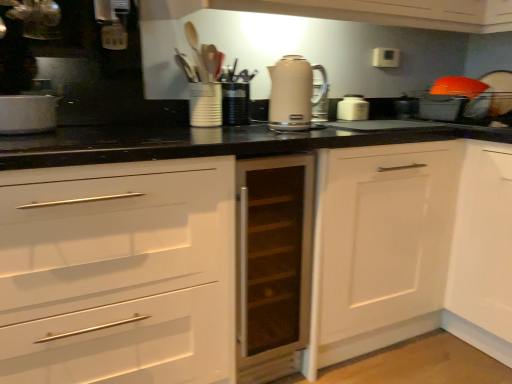
Question: Can you confirm if matte white container at center, which is counted as the 2th appliance, starting from the right, is bigger than transparent glass cabinet at center, which appears as the second cabinetry when viewed from the right?

Choices:
 (A) no
 (B) yes

Answer: (A)

Question: Can transparent glass cabinet at center, the 1th cabinetry positioned from the left, be found inside matte white container at center, which is counted as the 2th appliance, starting from the right?

Choices:
 (A) yes
 (B) no

Answer: (B)

Question: Is matte white container at center, acting as the 1th appliance starting from the left, smaller than transparent glass cabinet at center, the 1th cabinetry positioned from the left?

Choices:
 (A) yes
 (B) no

Answer: (A)

Question: Could you tell me if matte white container at center, which is counted as the 2th appliance, starting from the right, is facing transparent glass cabinet at center, which appears as the second cabinetry when viewed from the right?

Choices:
 (A) yes
 (B) no

Answer: (B)

Question: Is matte white container at center, which is counted as the 2th appliance, starting from the right, taller or shorter than black plastic container at center, which ranks as the second appliance in left-to-right order?

Choices:
 (A) short
 (B) tall

Answer: (B)

Question: Which is correct: matte white container at center, which is counted as the 2th appliance, starting from the right, is inside black plastic container at center, which ranks as the second appliance in left-to-right order, or outside of it?

Choices:
 (A) inside
 (B) outside

Answer: (B)

Question: From the image's perspective, is matte white container at center, which is counted as the 2th appliance, starting from the right, located above or below black plastic container at center, the first appliance when ordered from right to left?

Choices:
 (A) below
 (B) above

Answer: (A)

Question: Relative to black plastic container at center, the first appliance when ordered from right to left, is matte white container at center, which is counted as the 2th appliance, starting from the right, in front or behind?

Choices:
 (A) front
 (B) behind

Answer: (A)

Question: In terms of height, does black plastic container at center, which ranks as the second appliance in left-to-right order, look taller or shorter compared to white glossy toaster at center, which is counted as the third kitchen appliance, starting from the front?

Choices:
 (A) tall
 (B) short

Answer: (A)

Question: Considering their positions, is black plastic container at center, the first appliance when ordered from right to left, located in front of or behind white glossy toaster at center, which is the 3th kitchen appliance from left to right?

Choices:
 (A) front
 (B) behind

Answer: (A)

Question: Considering the relative positions of black plastic container at center, which ranks as the second appliance in left-to-right order, and white glossy toaster at center, which appears as the 1th kitchen appliance when viewed from the right, in the image provided, is black plastic container at center, which ranks as the second appliance in left-to-right order, to the left or to the right of white glossy toaster at center, which appears as the 1th kitchen appliance when viewed from the right,?

Choices:
 (A) right
 (B) left

Answer: (B)

Question: Is point (x=239, y=97) positioned closer to the camera than point (x=336, y=115)?

Choices:
 (A) closer
 (B) farther

Answer: (A)

Question: Is point (221, 115) closer or farther from the camera than point (281, 109)?

Choices:
 (A) closer
 (B) farther

Answer: (B)

Question: Visually, is matte white container at center, which is counted as the 2th appliance, starting from the right, positioned to the left or to the right of beige glossy electric kettle at center, placed as the 2th kitchen appliance when sorted from front to back?

Choices:
 (A) left
 (B) right

Answer: (A)